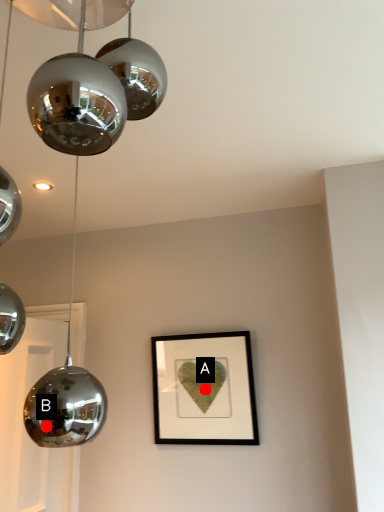
Question: Two points are circled on the image, labeled by A and B beside each circle. Which of the following is the closest to the observer?

Choices:
 (A) A is closer
 (B) B is closer

Answer: (B)